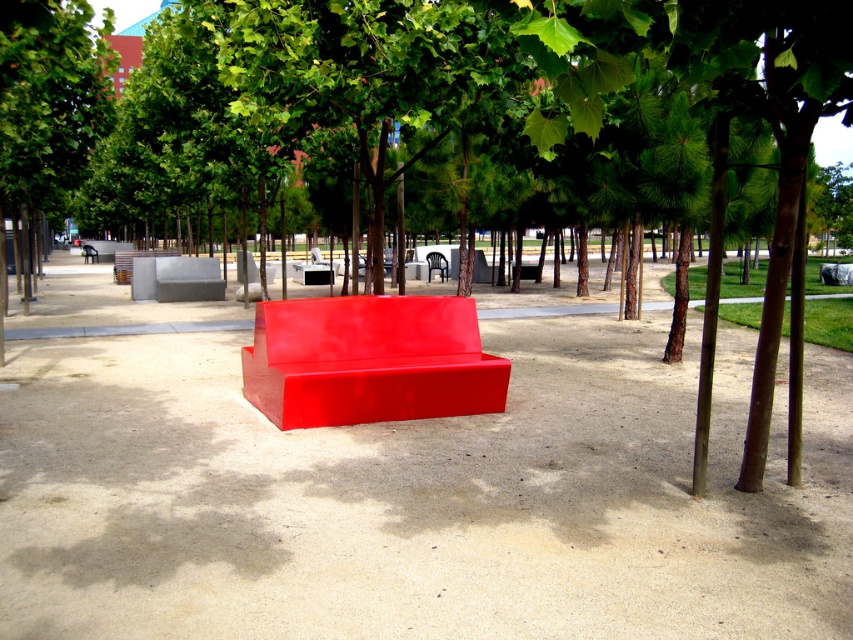
You are a person of average height wanting to sit on either the glossy red bench at center or the black plastic chair at center. Which one would require you to bend down more to sit on?

The black plastic chair at center is shorter than the glossy red bench at center, so you would need to bend down more to sit on the black plastic chair at center.

Looking at this image, you are planning to host a small gathering in the park and need to seat four people. The glossy red bench at center can seat two people. Can the black plastic chair at center accommodate the remaining two guests?

The glossy red bench at center is bigger than black plastic chair at center. Since the bench can seat two people, the smaller black plastic chair at center likely can only seat one person, so it cannot accommodate the remaining two guests.

You are a park visitor who wants to sit on the bench that is higher up. Which bench should you choose between the glossy red bench at center and the matte gray bench at center?

The matte gray bench at center is higher up because the glossy red bench at center is located below it.